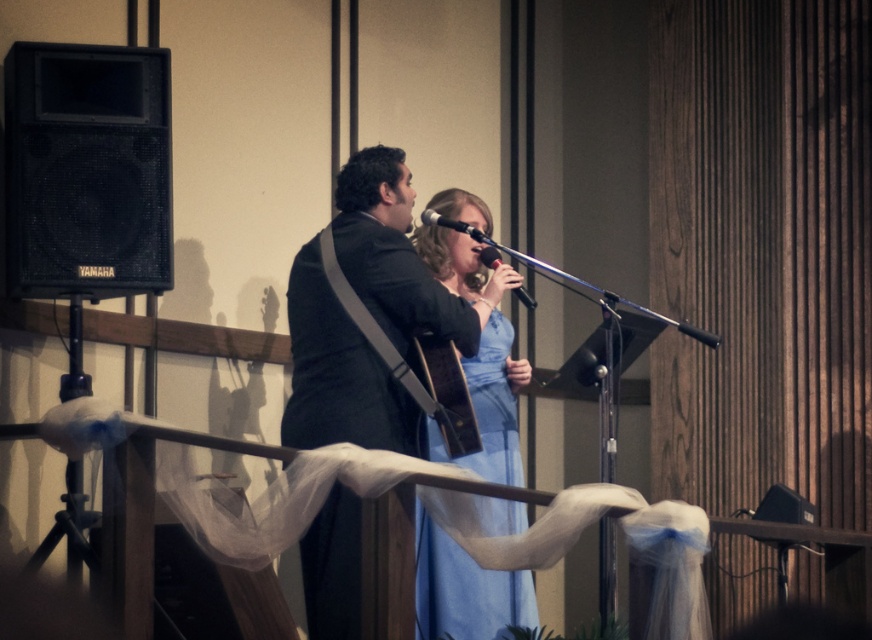
Question: Does black mesh speaker at left have a greater width compared to black matte microphone at center?

Choices:
 (A) yes
 (B) no

Answer: (A)

Question: Based on their relative distances, which object is nearer to the dark gray suit at center?

Choices:
 (A) black metallic microphone at center
 (B) black mesh speaker at left
 (C) black matte microphone at center
 (D) light blue satin dress at center

Answer: (D)

Question: Which object is positioned farthest from the dark gray suit at center?

Choices:
 (A) black matte microphone at center
 (B) light blue satin dress at center
 (C) black mesh speaker at left

Answer: (C)

Question: Can you confirm if black mesh speaker at left is positioned to the right of black metallic microphone at center?

Choices:
 (A) no
 (B) yes

Answer: (A)

Question: Which point is closer to the camera?

Choices:
 (A) black matte microphone at center
 (B) black mesh speaker at left
 (C) black metallic microphone at center
 (D) light blue satin dress at center

Answer: (D)

Question: Is the position of black mesh speaker at left more distant than that of black metallic microphone at center?

Choices:
 (A) yes
 (B) no

Answer: (B)